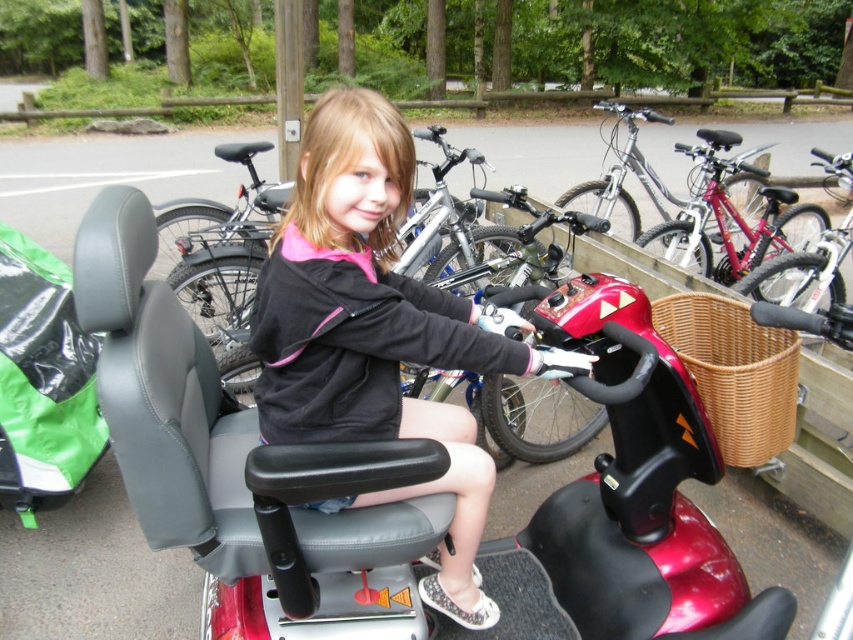
You are standing at the point with coordinates (x=408, y=483). What object is located exactly at your current position?

The shiny red scooter at center is located exactly at the point with coordinates (x=408, y=483).

You are trying to park your shiny red scooter at center in a space that can only accommodate items narrower than the shiny red bicycle at center. Based on the scene, can your scooter fit in the space?

The shiny red scooter at center has a lesser width compared to the shiny red bicycle at center, so it will fit in the space.

You are trying to determine if the black leather jacket at center can fit into a storage compartment designed for items smaller than the shiny red bicycle at center. Based on the scene, can the jacket fit?

The black leather jacket at center occupies less space than the shiny red bicycle at center, so it can fit into the storage compartment designed for items smaller than the bicycle.